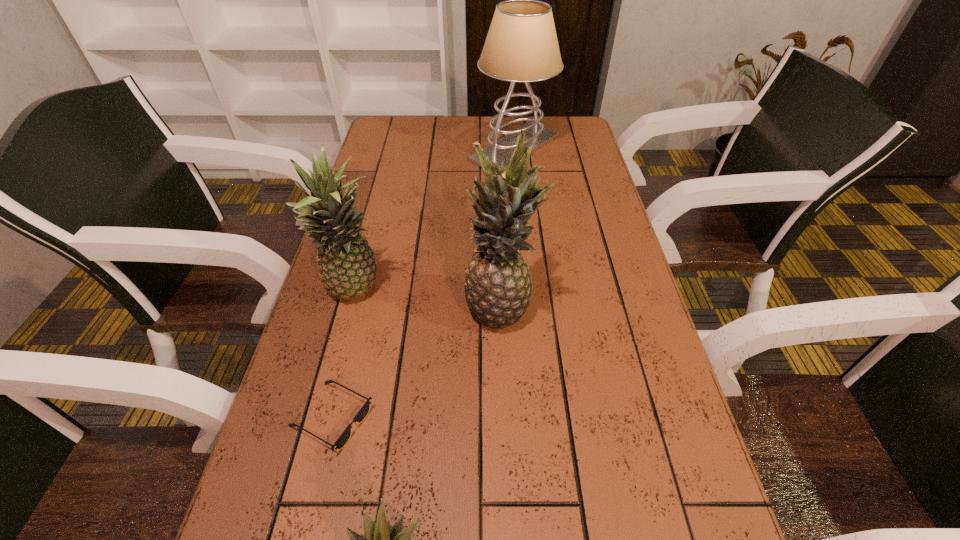
I want to click on empty location between the rightmost pineapple and the second nearest object, so click(417, 363).

Find the location of `vacant region between the leftmost pineapple and the second nearest object`. vacant region between the leftmost pineapple and the second nearest object is located at coordinates (345, 355).

This screenshot has height=540, width=960. I want to click on unoccupied position between the leftmost pineapple and the sunglasses, so click(345, 355).

You are a GUI agent. You are given a task and a screenshot of the screen. Output one action in this format:
    pyautogui.click(x=<x>, y=<y>)
    Task: Click on the free space between the leftmost pineapple and the shortest object
    
    Given the screenshot: What is the action you would take?
    pyautogui.click(x=345, y=355)

At what (x,y) coordinates should I click in order to perform the action: click on unoccupied area between the farthest object and the leftmost pineapple. Please return your answer as a coordinate pair (x, y). This screenshot has height=540, width=960. Looking at the image, I should click on (436, 221).

The height and width of the screenshot is (540, 960). In order to click on vacant area that lies between the sunglasses and the leftmost pineapple in this screenshot , I will do `click(345, 355)`.

Where is `object that is the second closest one to the nearest object`? object that is the second closest one to the nearest object is located at coordinates (498, 285).

Locate which object is the closest to the farthest object. Please provide its 2D coordinates. Your answer should be formatted as a tuple, i.e. [(x, y)], where the tuple contains the x and y coordinates of a point satisfying the conditions above.

[(347, 265)]

Find the location of `pineapple that can be found as the closest to the farthest object`. pineapple that can be found as the closest to the farthest object is located at coordinates (347, 265).

Identify which pineapple is located as the second nearest to the leftmost pineapple. Please provide its 2D coordinates. Your answer should be formatted as a tuple, i.e. [(x, y)], where the tuple contains the x and y coordinates of a point satisfying the conditions above.

[(379, 539)]